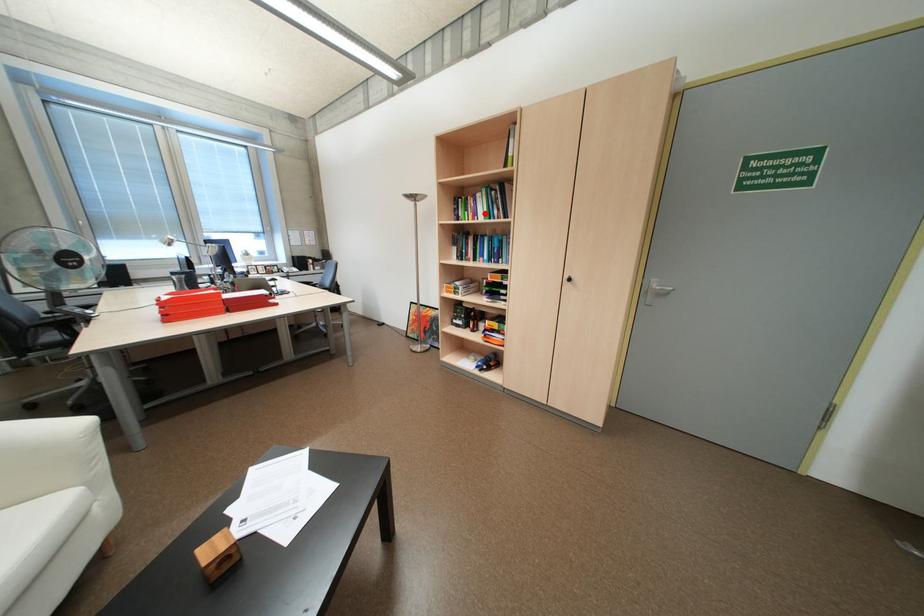
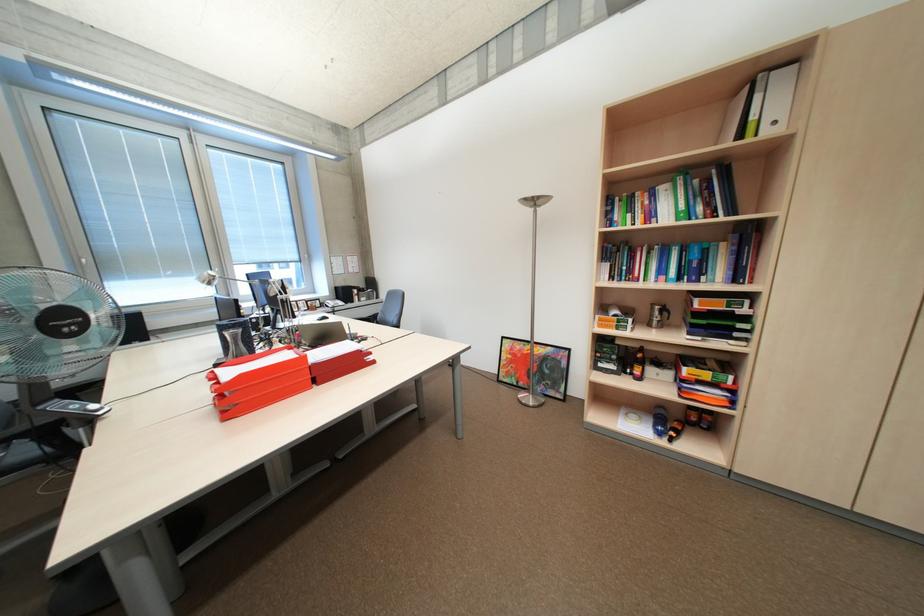
Locate, in the second image, the point that corresponds to the highlighted location in the first image.

(661, 215)